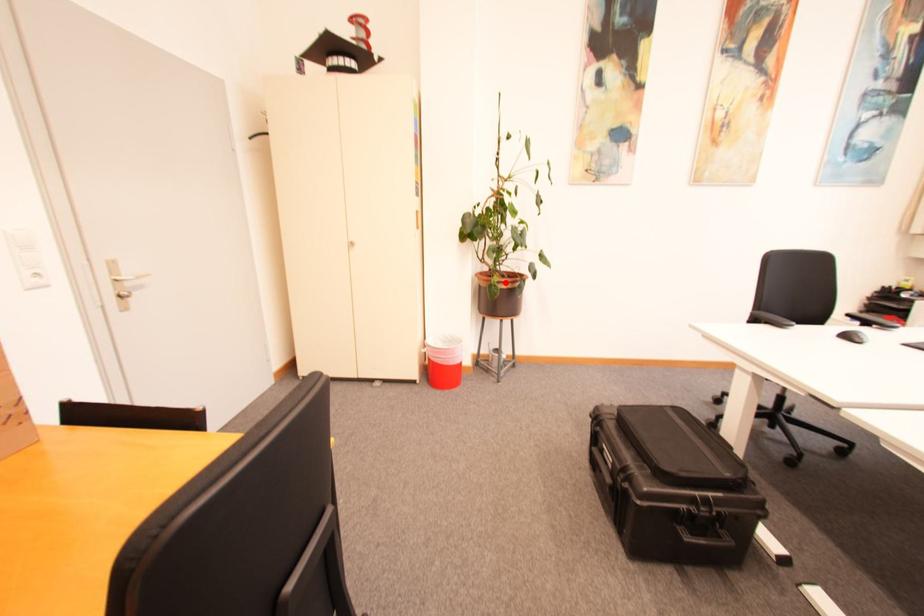
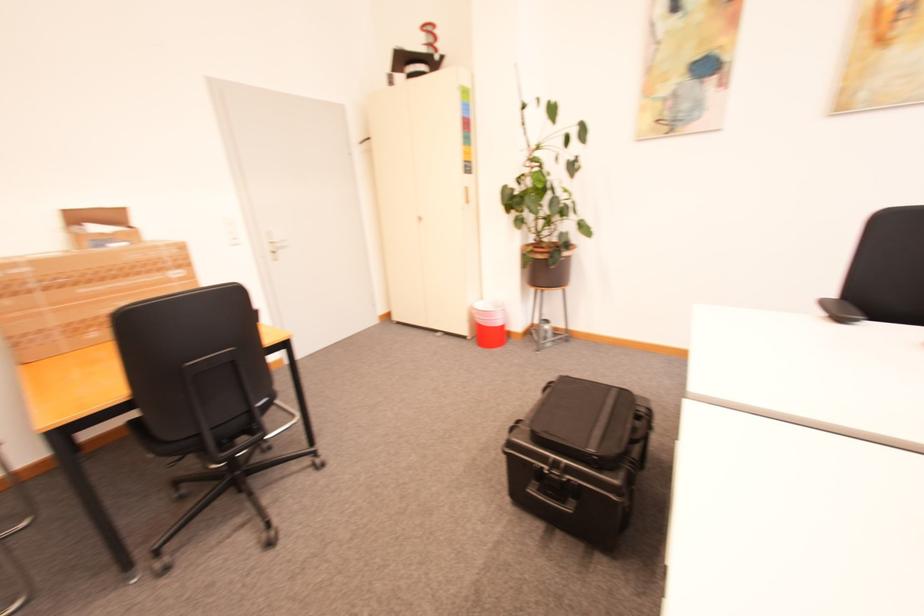
Question: I am providing you with two images of the same scene from different viewpoints. Given a red point in image1, look at the same physical point in image2. Is it:

Choices:
 (A) Closer to the viewpoint
 (B) Farther from the viewpoint

Answer: (A)